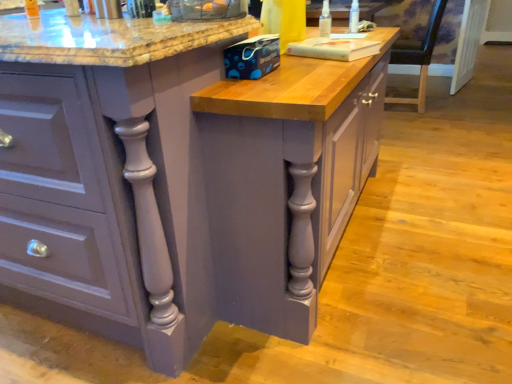
Image resolution: width=512 pixels, height=384 pixels. In order to click on vacant area that is situated to the right of matte gray cabinet at center in this screenshot , I will do `click(435, 200)`.